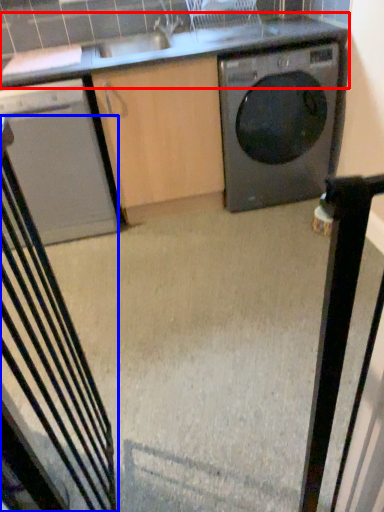
Question: Which point is further to the camera, countertop (highlighted by a red box) or rocking chair (highlighted by a blue box)?

Choices:
 (A) countertop
 (B) rocking chair

Answer: (A)